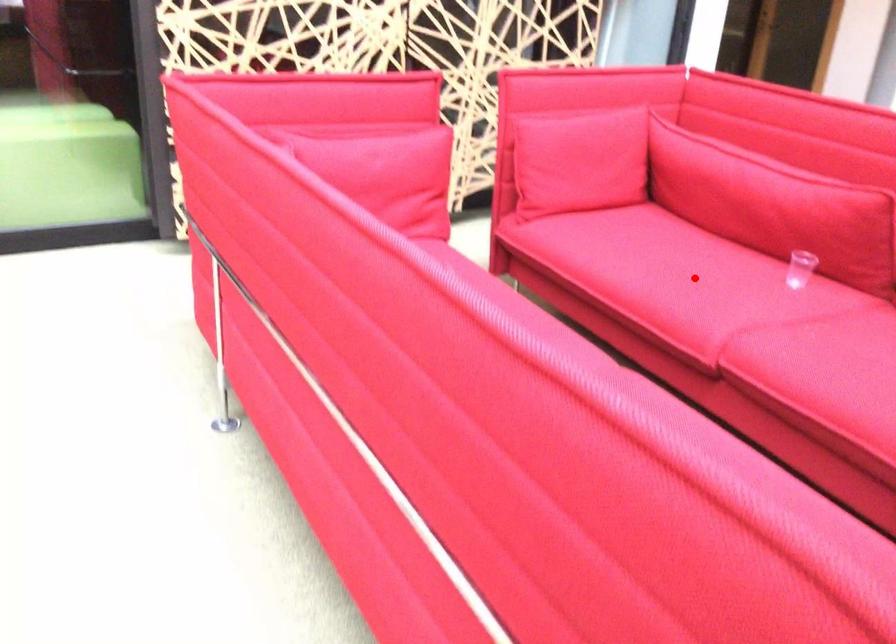
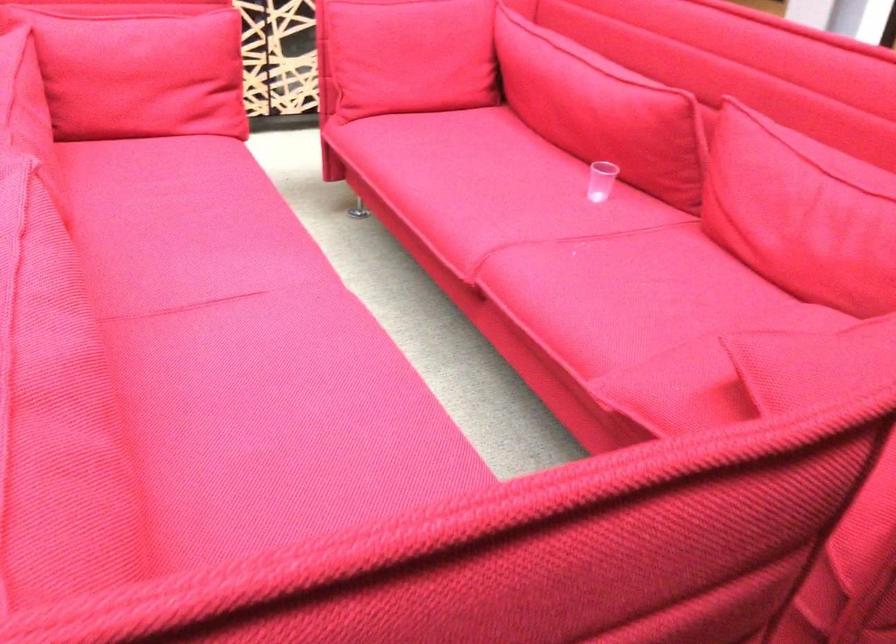
Find the pixel in the second image that matches the highlighted location in the first image.

(488, 192)